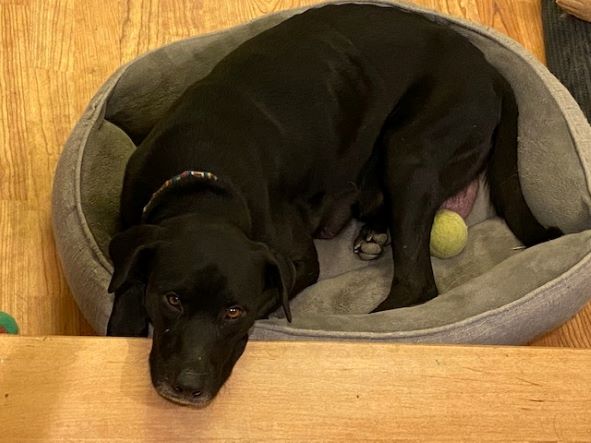
The image size is (591, 443). Find the location of `toy dog`. toy dog is located at coordinates (12, 323).